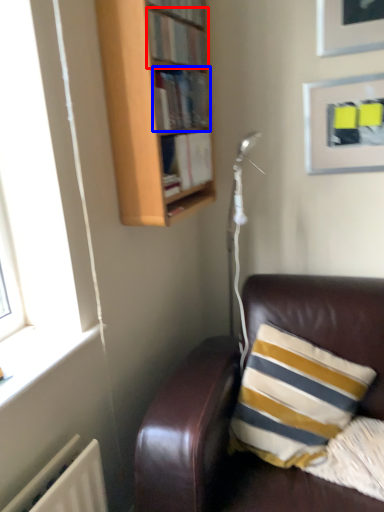
Question: Among these objects, which one is nearest to the camera, book (highlighted by a red box) or book (highlighted by a blue box)?

Choices:
 (A) book
 (B) book

Answer: (A)